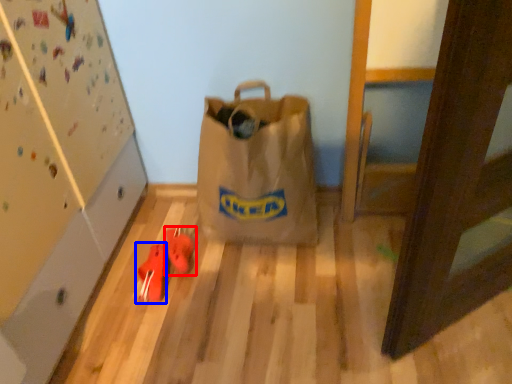
Question: Which of the following is the farthest to the observer, footwear (highlighted by a red box) or footwear (highlighted by a blue box)?

Choices:
 (A) footwear
 (B) footwear

Answer: (A)